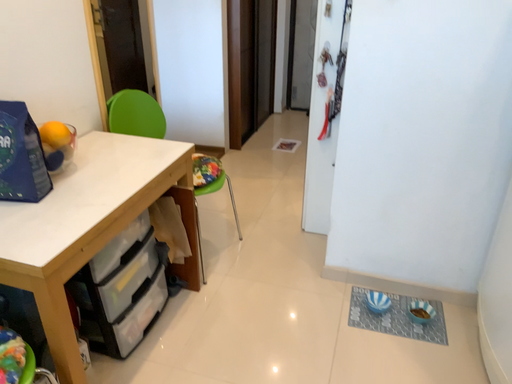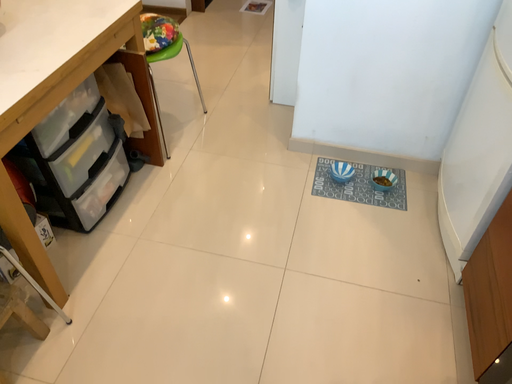
Question: Which way did the camera rotate in the video?

Choices:
 (A) rotated upward
 (B) rotated downward

Answer: (B)